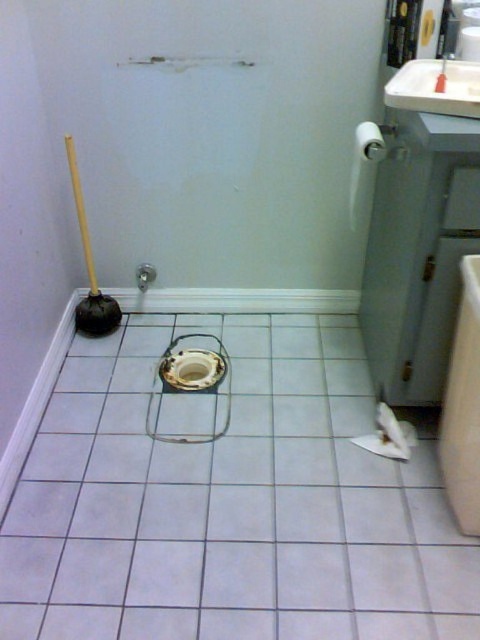
Can you confirm if white glossy sink at lower right is thinner than white glossy sink at upper right?

Yes.

This screenshot has height=640, width=480. What do you see at coordinates (463, 406) in the screenshot? I see `white glossy sink at lower right` at bounding box center [463, 406].

Find the location of a particular element. The width and height of the screenshot is (480, 640). white glossy sink at lower right is located at coordinates (463, 406).

Does white glossy sink at upper right appear under matte black plunger at center-left?

Correct, white glossy sink at upper right is located below matte black plunger at center-left.

What do you see at coordinates (435, 88) in the screenshot? I see `white glossy sink at upper right` at bounding box center [435, 88].

What are the coordinates of `white glossy sink at upper right` in the screenshot? It's located at (435, 88).

Is point (456, 440) more distant than point (439, 77)?

Yes, point (456, 440) is farther from viewer.

What do you see at coordinates (463, 406) in the screenshot? The width and height of the screenshot is (480, 640). I see `white glossy sink at lower right` at bounding box center [463, 406].

Does point (455, 481) come behind point (442, 67)?

That is False.

The height and width of the screenshot is (640, 480). What are the coordinates of `white glossy sink at lower right` in the screenshot? It's located at (463, 406).